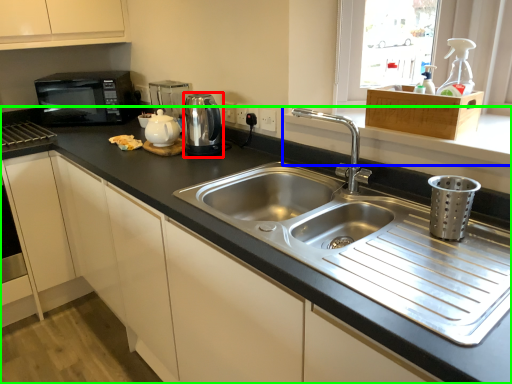
Question: Estimate the real-world distances between objects in this image. Which object is farther from appliance (highlighted by a red box), window sill (highlighted by a blue box) or countertop (highlighted by a green box)?

Choices:
 (A) window sill
 (B) countertop

Answer: (A)